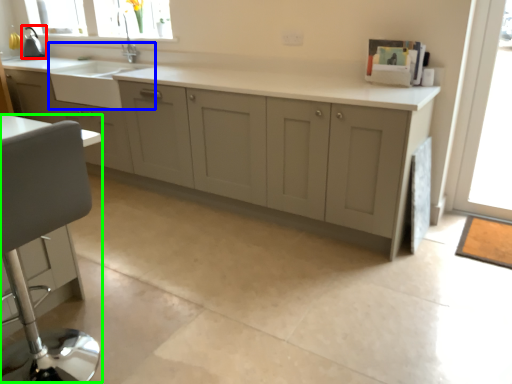
Question: Estimate the real-world distances between objects in this image. Which object is farther from appliance (highlighted by a red box), sink (highlighted by a blue box) or swivel chair (highlighted by a green box)?

Choices:
 (A) sink
 (B) swivel chair

Answer: (B)